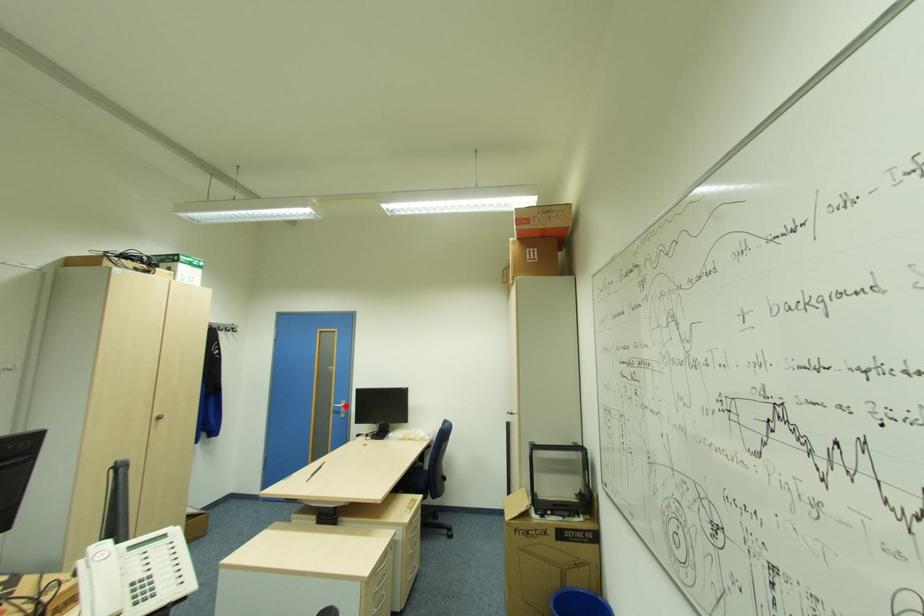
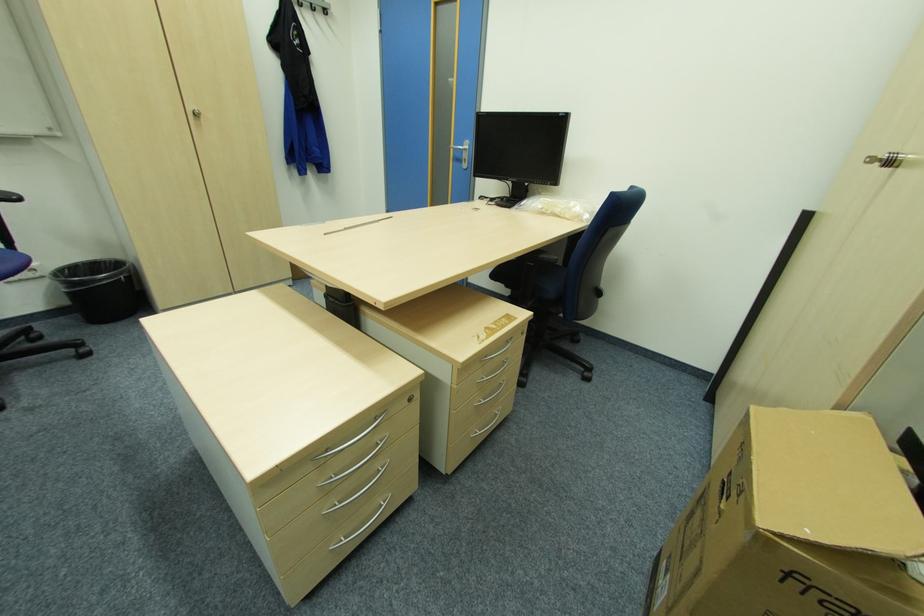
Find the pixel in the second image that matches the highlighted location in the first image.

(468, 148)